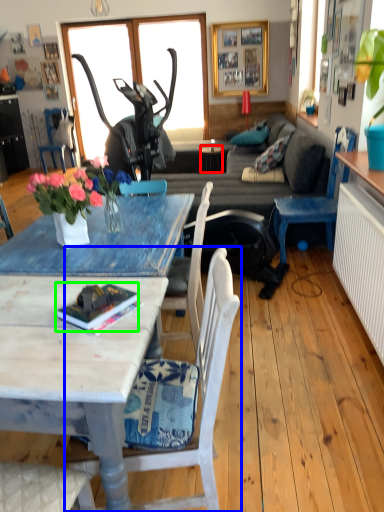
Question: Which object is the farthest from side table (highlighted by a red box)? Choose among these: chair (highlighted by a blue box) or book (highlighted by a green box).

Choices:
 (A) chair
 (B) book

Answer: (B)